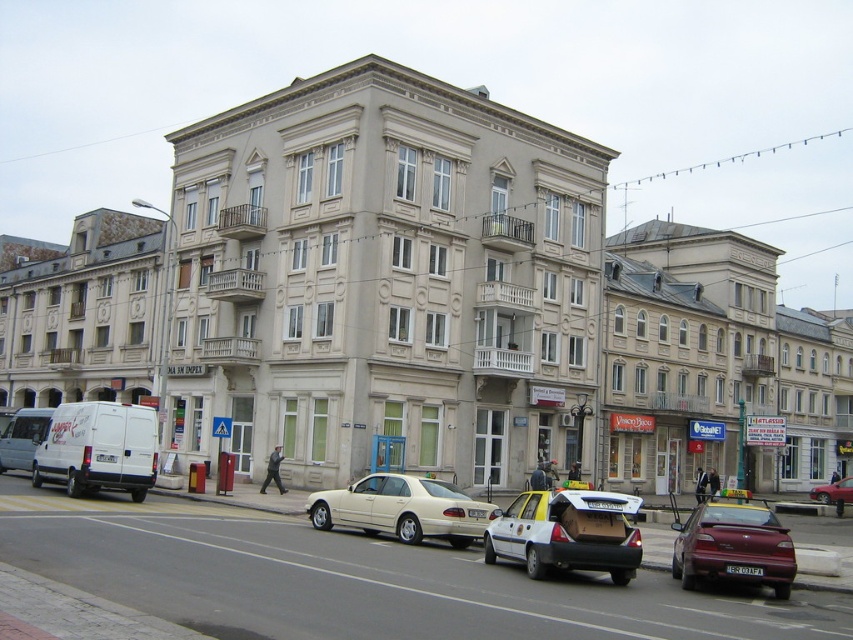
Question: Which object is the farthest from the maroon glossy sedan at lower right?

Choices:
 (A) black plastic license plate at center
 (B) white plastic taxi at center

Answer: (B)

Question: Can you confirm if white plastic taxi at center is wider than black plastic license plate at center?

Choices:
 (A) no
 (B) yes

Answer: (B)

Question: Which of the following is the farthest from the observer?

Choices:
 (A) metallic silver sedan at center
 (B) black plastic license plate at center

Answer: (A)

Question: Which point is farther to the camera?

Choices:
 (A) (846, 481)
 (B) (32, 429)
 (C) (621, 500)
 (D) (375, 493)

Answer: (A)

Question: Is white plastic taxi at center to the left of black plastic license plate at center from the viewer's perspective?

Choices:
 (A) no
 (B) yes

Answer: (B)

Question: Does white plastic taxi at center appear on the right side of matte beige sedan at center?

Choices:
 (A) yes
 (B) no

Answer: (A)